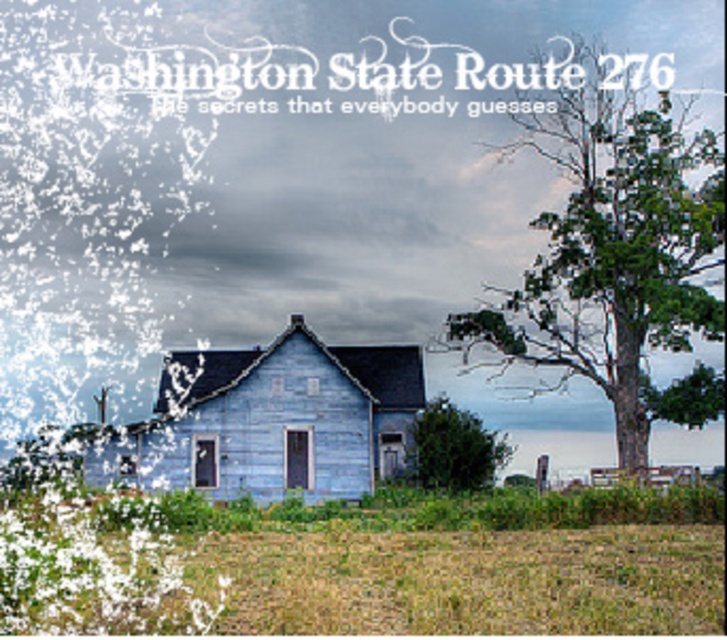
Question: Estimate the real-world distances between objects in this image. Which object is farther from the green grass at lower center?

Choices:
 (A) green leafy tree at center
 (B) green textured tree at right

Answer: (A)

Question: Does green grass at lower center have a larger size compared to green leafy tree at center?

Choices:
 (A) yes
 (B) no

Answer: (A)

Question: Which point is farther from the camera taking this photo?

Choices:
 (A) (465, 595)
 (B) (470, 428)

Answer: (B)

Question: Does green grass at lower center have a lesser width compared to green textured tree at right?

Choices:
 (A) no
 (B) yes

Answer: (A)

Question: Can you confirm if green grass at lower center is wider than green textured tree at right?

Choices:
 (A) yes
 (B) no

Answer: (A)

Question: Which point is farther to the camera?

Choices:
 (A) (569, 540)
 (B) (696, 189)
 (C) (441, 429)

Answer: (B)